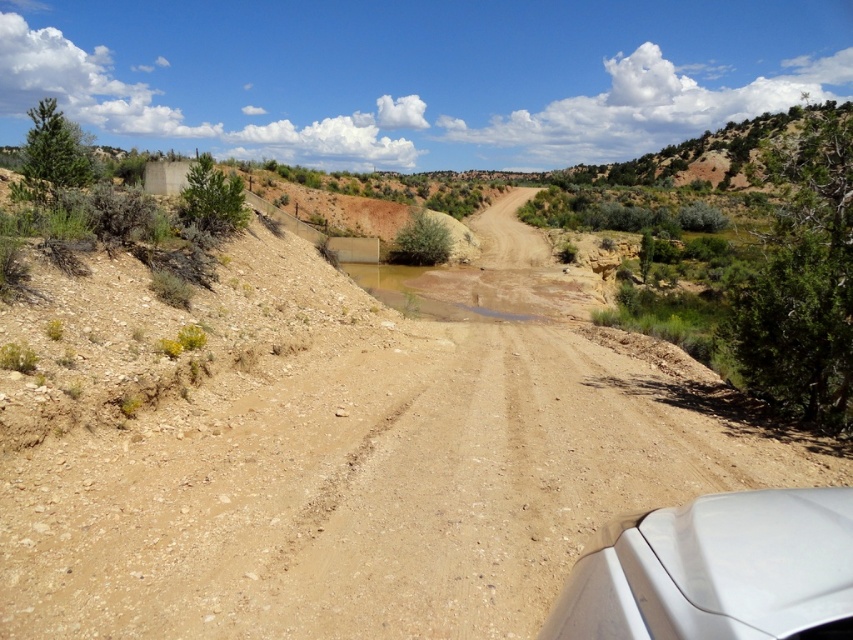
Question: Which point is closer to the camera?

Choices:
 (A) (703, 570)
 (B) (505, 298)
 (C) (492, 464)

Answer: (A)

Question: Which of the following is the closest to the observer?

Choices:
 (A) white matte car at lower right
 (B) brown sandy puddle at center

Answer: (A)

Question: Can you confirm if brown sandy dirt at center is thinner than brown sandy puddle at center?

Choices:
 (A) yes
 (B) no

Answer: (A)

Question: Which of the following is the farthest from the observer?

Choices:
 (A) brown sandy dirt at center
 (B) brown sandy puddle at center
 (C) white matte car at lower right

Answer: (B)

Question: Is white matte car at lower right closer to camera compared to brown sandy puddle at center?

Choices:
 (A) no
 (B) yes

Answer: (B)

Question: Is white matte car at lower right above brown sandy puddle at center?

Choices:
 (A) no
 (B) yes

Answer: (A)